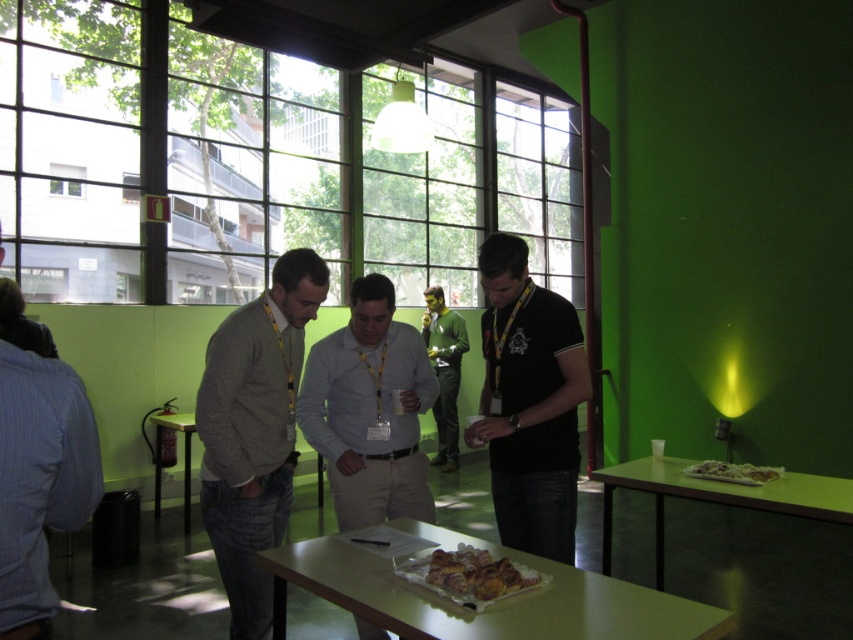
Question: Which point is closer to the camera?

Choices:
 (A) green jersey at center
 (B) black matte shirt at center
 (C) transparent glass window at upper center

Answer: (B)

Question: Can you confirm if black matte shirt at center is bigger than golden brown croissant at center?

Choices:
 (A) no
 (B) yes

Answer: (B)

Question: Which point is closer to the camera taking this photo?

Choices:
 (A) (44, 115)
 (B) (767, 529)
 (C) (270, 604)
 (D) (701, 476)

Answer: (C)

Question: Does gray sweater at center come behind green matte table at lower right?

Choices:
 (A) no
 (B) yes

Answer: (A)

Question: Which point is farther to the camera?

Choices:
 (A) (531, 346)
 (B) (143, 141)
 (C) (78, 179)
 (D) (216, 444)

Answer: (B)

Question: Is black matte shirt at center positioned before green jersey at center?

Choices:
 (A) yes
 (B) no

Answer: (A)